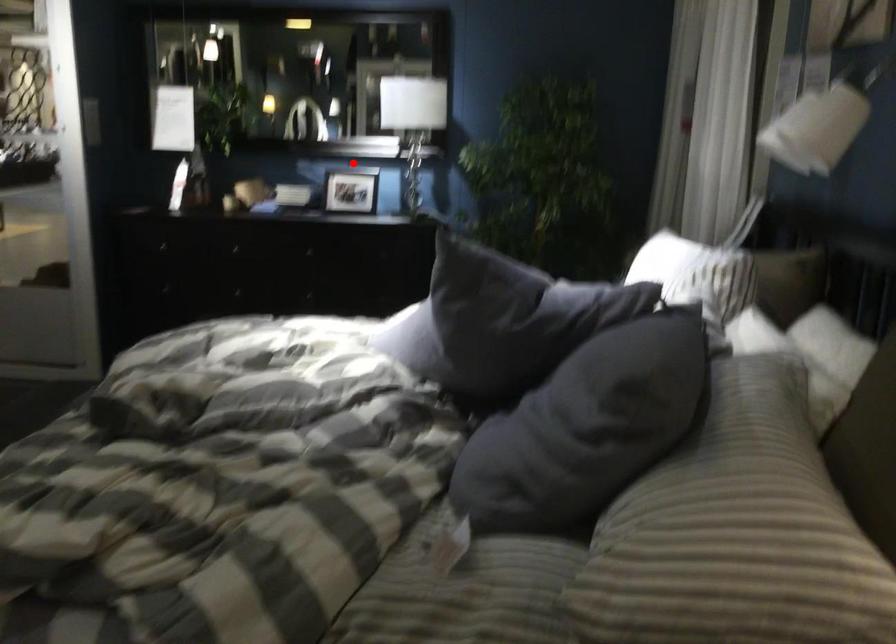
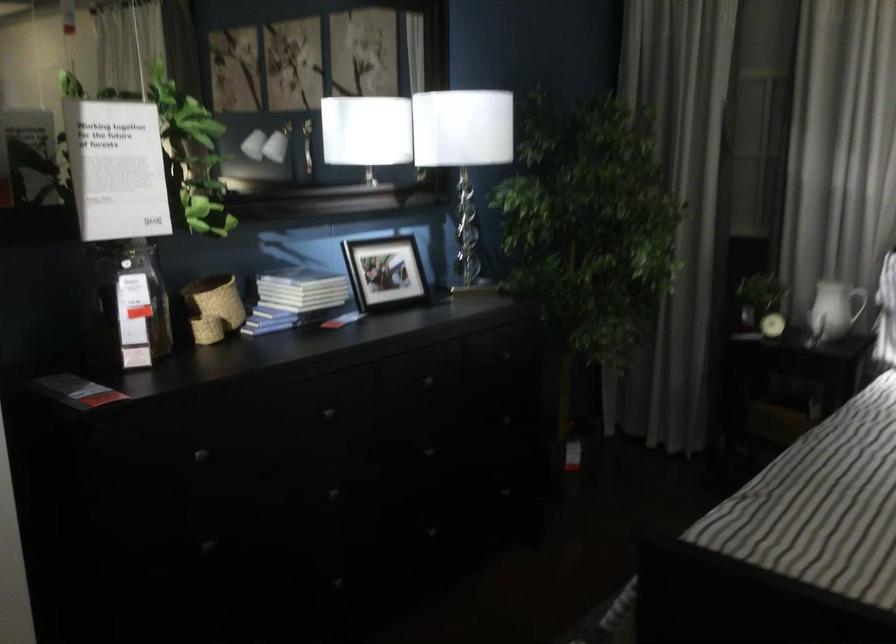
The point at the highlighted location is marked in the first image. Where is the corresponding point in the second image?

(384, 272)